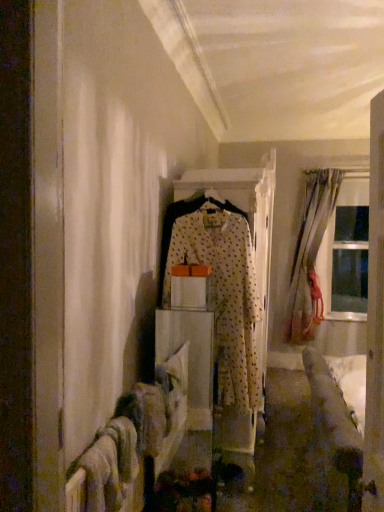
This screenshot has height=512, width=384. I want to click on white fabric at center, so click(x=190, y=358).

The image size is (384, 512). I want to click on transparent glass window at right, so click(346, 252).

Identify the location of wooden door at right. Image resolution: width=384 pixels, height=512 pixels. (375, 320).

Which is farther, (349, 293) or (157, 313)?

The point (349, 293) is behind.

Based on the photo, is transparent glass window at right in front of or behind white fabric at center in the image?

transparent glass window at right is positioned farther from the viewer than white fabric at center.

From the image's perspective, would you say transparent glass window at right is positioned over white fabric at center?

Result: Yes, from the image's perspective, transparent glass window at right is on top of white fabric at center.

In the scene shown: Is silky beige curtain at right shorter than white fabric at center?

No.

In the scene shown: Which is correct: silky beige curtain at right is inside white fabric at center, or outside of it?

silky beige curtain at right exists outside the volume of white fabric at center.

Which of these two, silky beige curtain at right or white fabric at center, is smaller?

white fabric at center.

Considering the relative sizes of wooden door at right and silky beige curtain at right in the image provided, is wooden door at right bigger than silky beige curtain at right?

No.

Are wooden door at right and silky beige curtain at right making contact?

They are not placed beside each other.

Based on the photo, which object is wider, wooden door at right or silky beige curtain at right?

silky beige curtain at right is wider.

Does wooden door at right come in front of silky beige curtain at right?

Yes, wooden door at right is closer to the viewer.

From the image's perspective, is silky beige curtain at right located beneath wooden door at right?

No, from the image's perspective, silky beige curtain at right is not beneath wooden door at right.

Is silky beige curtain at right oriented away from wooden door at right?

No, wooden door at right is not at the back of silky beige curtain at right.

Who is smaller, silky beige curtain at right or wooden door at right?

With smaller size is wooden door at right.

From a real-world perspective, which object stands above the other?

silky beige curtain at right.

Are wooden door at right and white fabric at center beside each other?

wooden door at right and white fabric at center are clearly separated.

From the image's perspective, is wooden door at right located beneath white fabric at center?

No, from the image's perspective, wooden door at right is not below white fabric at center.

Considering the relative positions of wooden door at right and white fabric at center in the image provided, is wooden door at right to the left of white fabric at center from the viewer's perspective?

No.

Is wooden door at right closer to the viewer compared to white fabric at center?

Yes.

Between white dotted fabric at center and silky beige curtain at right, which one has smaller width?

white dotted fabric at center.

From a real-world perspective, is white dotted fabric at center positioned over silky beige curtain at right based on gravity?

Incorrect, from a real-world perspective, white dotted fabric at center is lower than silky beige curtain at right.

From the image's perspective, which one is positioned higher, white dotted fabric at center or silky beige curtain at right?

silky beige curtain at right appears higher in the image.

Could you tell me if white fabric at center is turned towards silky beige curtain at right?

No, white fabric at center is not oriented towards silky beige curtain at right.

Can we say white fabric at center lies outside silky beige curtain at right?

white fabric at center is positioned outside silky beige curtain at right.

Does white fabric at center have a smaller size compared to silky beige curtain at right?

Yes, white fabric at center is smaller than silky beige curtain at right.

The width and height of the screenshot is (384, 512). I want to click on window that is above the white fabric at center (from a real-world perspective), so click(x=346, y=252).

I want to click on curtain located above the white fabric at center (from the image's perspective), so click(310, 257).

Considering their positions, is wooden door at right positioned further to white fabric at center than white dotted fabric at center?

Among the two, wooden door at right is located further to white fabric at center.

When comparing their distances from transparent glass window at right, does white fabric at center or white dotted fabric at center seem further?

white dotted fabric at center lies further to transparent glass window at right than the other object.

When comparing their distances from wooden door at right, does transparent glass window at right or white fabric at center seem further?

transparent glass window at right.

Looking at this image, looking at the image, which one is located closer to silky beige curtain at right, transparent glass window at right or wooden door at right?

transparent glass window at right is closer to silky beige curtain at right.

Looking at the image, which one is located further to white fabric at center, transparent glass window at right or wooden door at right?

Among the two, transparent glass window at right is located further to white fabric at center.

Considering their positions, is white fabric at center positioned further to silky beige curtain at right than white dotted fabric at center?

white dotted fabric at center.

From the picture: From the image, which object appears to be farther from white dotted fabric at center, silky beige curtain at right or wooden door at right?

silky beige curtain at right lies further to white dotted fabric at center than the other object.

Which object lies nearer to the anchor point white dotted fabric at center, white fabric at center or silky beige curtain at right?

Based on the image, white fabric at center appears to be nearer to white dotted fabric at center.

The width and height of the screenshot is (384, 512). Identify the location of curtain between wooden door at right and transparent glass window at right in the front-back direction. (310, 257).

Identify the location of curtain between white fabric at center and transparent glass window at right along the z-axis. Image resolution: width=384 pixels, height=512 pixels. (310, 257).

Find the location of a particular element. furniture positioned between wooden door at right and silky beige curtain at right from near to far is located at coordinates (190, 358).

Identify the location of fancy dress between wooden door at right and transparent glass window at right in the front-back direction. Image resolution: width=384 pixels, height=512 pixels. (220, 289).